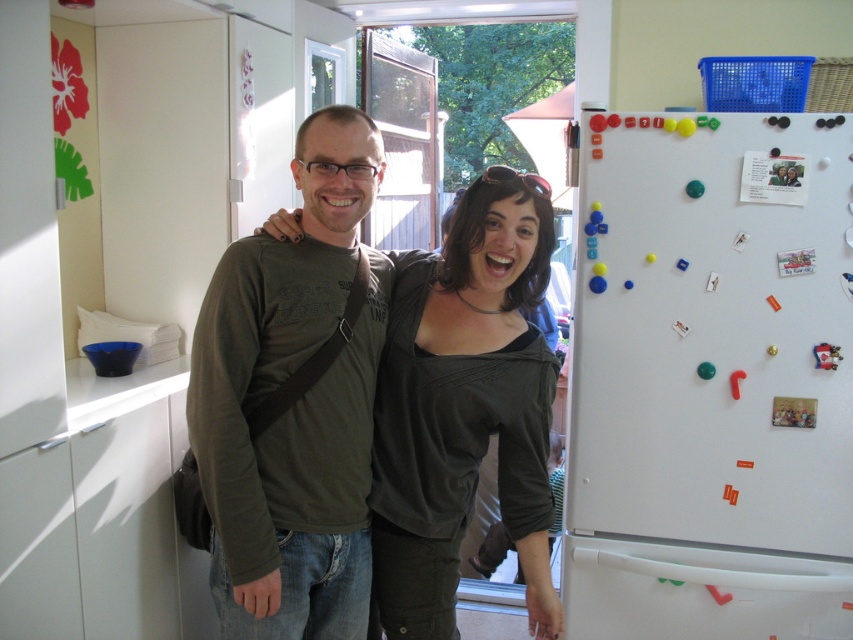
Is matte olive green shirt at center positioned before dark gray jersey at center?

Yes, matte olive green shirt at center is in front of dark gray jersey at center.

In the scene shown: Who is more distant from viewer, (297, 497) or (469, 205)?

The point (469, 205) is more distant.

What are the coordinates of `matte olive green shirt at center` in the screenshot? It's located at (291, 403).

Who is shorter, white matte refrigerator at right or dark gray jersey at center?

dark gray jersey at center

Is white matte refrigerator at right smaller than dark gray jersey at center?

Actually, white matte refrigerator at right might be larger than dark gray jersey at center.

Locate an element on the screen. This screenshot has width=853, height=640. white matte refrigerator at right is located at coordinates (711, 380).

Locate an element on the screen. white matte refrigerator at right is located at coordinates (711, 380).

The image size is (853, 640). Identify the location of white matte refrigerator at right. (711, 380).

Between point (665, 195) and point (309, 161), which one is positioned in front?

Point (309, 161) is more forward.

This screenshot has height=640, width=853. What are the coordinates of `white matte refrigerator at right` in the screenshot? It's located at (711, 380).